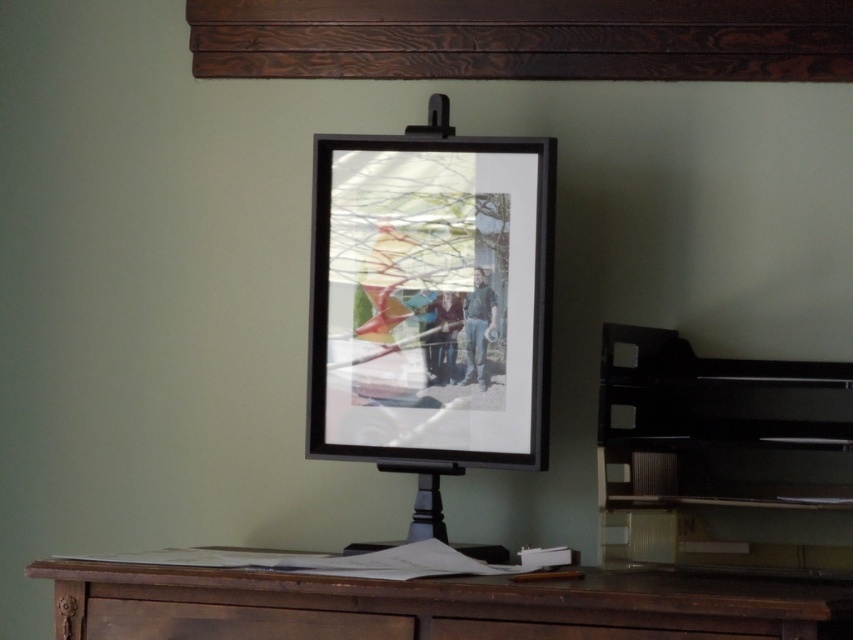
Question: Can you confirm if brown wooden table at lower center is thinner than brown wood drawer at lower center?

Choices:
 (A) yes
 (B) no

Answer: (B)

Question: Among these objects, which one is nearest to the camera?

Choices:
 (A) black matte picture frame at center
 (B) brown wooden table at lower center
 (C) brown wood drawer at lower center
 (D) black matte easel at center

Answer: (B)

Question: Which point is farther to the camera?

Choices:
 (A) (416, 308)
 (B) (383, 628)
 (C) (717, 401)
 (D) (612, 600)

Answer: (C)

Question: Which is farther from the black matte picture frame at center?

Choices:
 (A) black matte easel at center
 (B) brown wooden table at lower center
 (C) brown wood drawer at lower center

Answer: (C)

Question: Can you confirm if black matte easel at center is positioned above brown wooden table at lower center?

Choices:
 (A) no
 (B) yes

Answer: (B)

Question: Can you confirm if black matte picture frame at center is positioned to the right of brown wooden table at lower center?

Choices:
 (A) yes
 (B) no

Answer: (B)